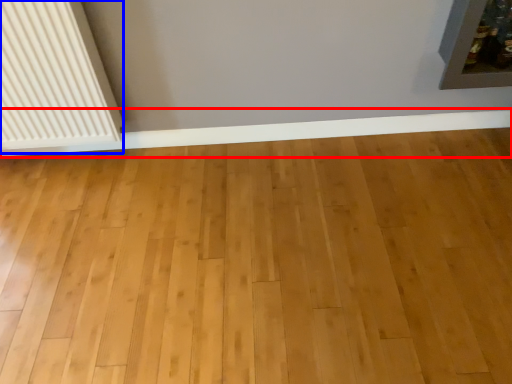
Question: Among these objects, which one is farthest to the camera, ledge (highlighted by a red box) or radiator (highlighted by a blue box)?

Choices:
 (A) ledge
 (B) radiator

Answer: (A)